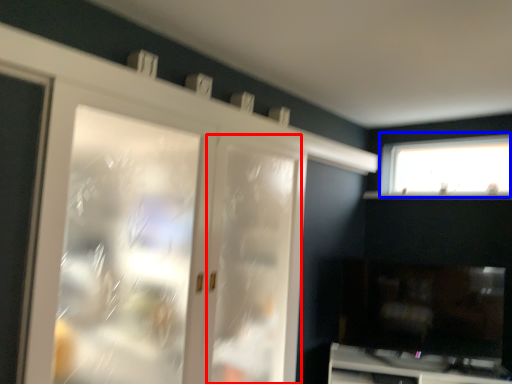
Question: Which of the following is the closest to the observer, screen door (highlighted by a red box) or window (highlighted by a blue box)?

Choices:
 (A) screen door
 (B) window

Answer: (A)